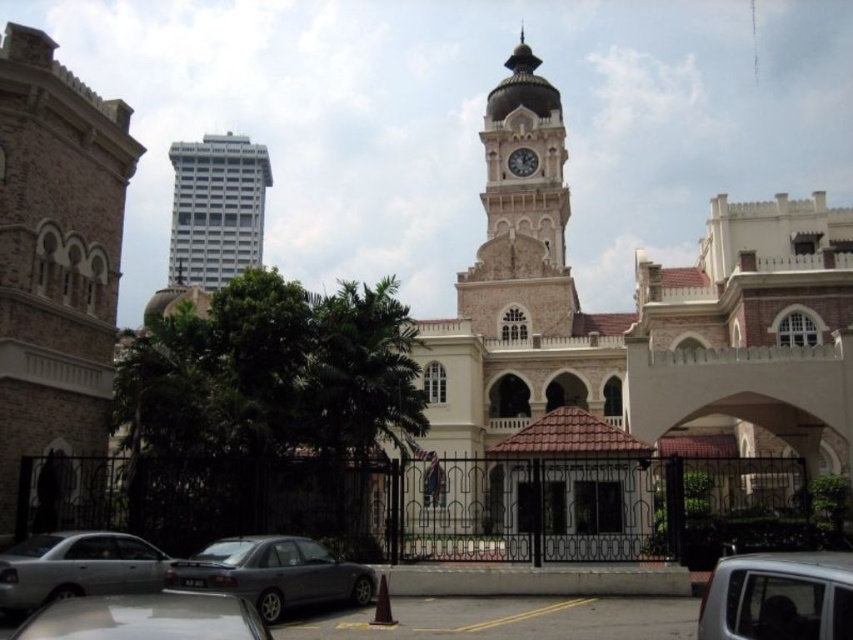
Does brown stone tower at left come behind silver metallic car at lower center?

That is True.

What do you see at coordinates (55, 256) in the screenshot? This screenshot has height=640, width=853. I see `brown stone tower at left` at bounding box center [55, 256].

Identify the location of brown stone tower at left. This screenshot has width=853, height=640. (55, 256).

Between point (566, 205) and point (219, 177), which one is positioned behind?

Point (219, 177)

Is point (524, 330) positioned in front of point (247, 163)?

That is True.

Which is in front, point (519, 116) or point (178, 208)?

Point (519, 116) is in front.

Where is `brown stone clock tower at center`? The height and width of the screenshot is (640, 853). brown stone clock tower at center is located at coordinates (521, 212).

Is point (241, 230) farther from camera compared to point (219, 584)?

Yes, it is behind point (219, 584).

Who is more distant from viewer, (242, 150) or (229, 589)?

The point (242, 150) is behind.

Is point (230, 212) farther from camera compared to point (267, 589)?

Yes, point (230, 212) is farther from viewer.

Identify the location of white glossy building at upper left. This screenshot has height=640, width=853. (216, 209).